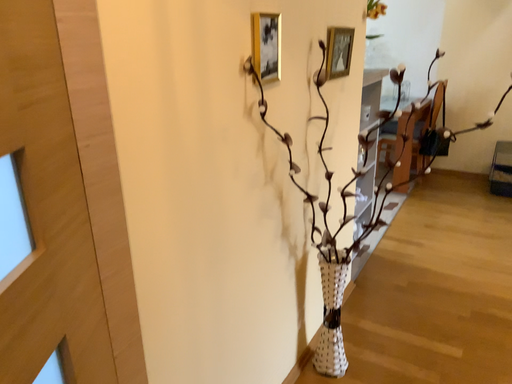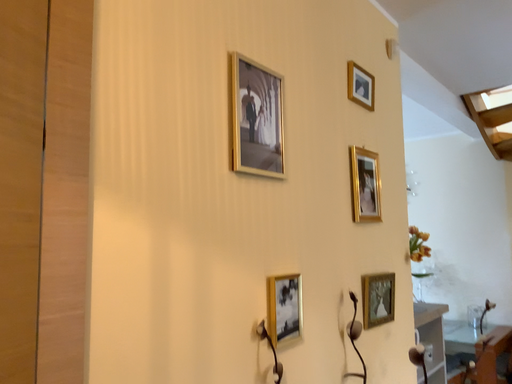
Question: How did the camera likely rotate when shooting the video?

Choices:
 (A) rotated downward
 (B) rotated upward

Answer: (B)